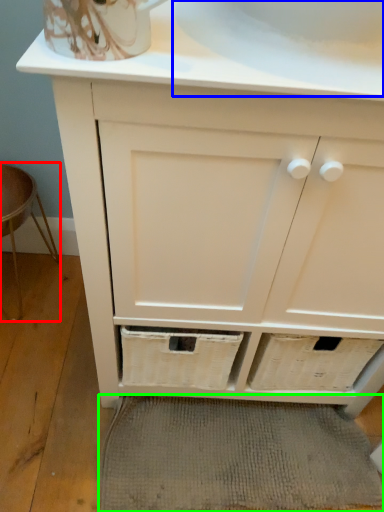
Question: Which is farther away from bar stool (highlighted by a red box)? sink (highlighted by a blue box) or bath mat (highlighted by a green box)?

Choices:
 (A) sink
 (B) bath mat

Answer: (A)